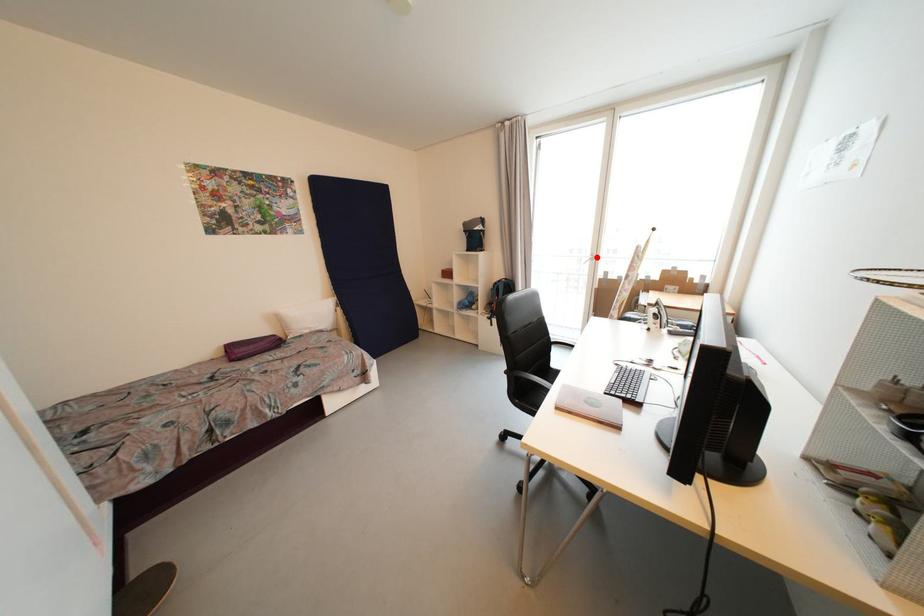
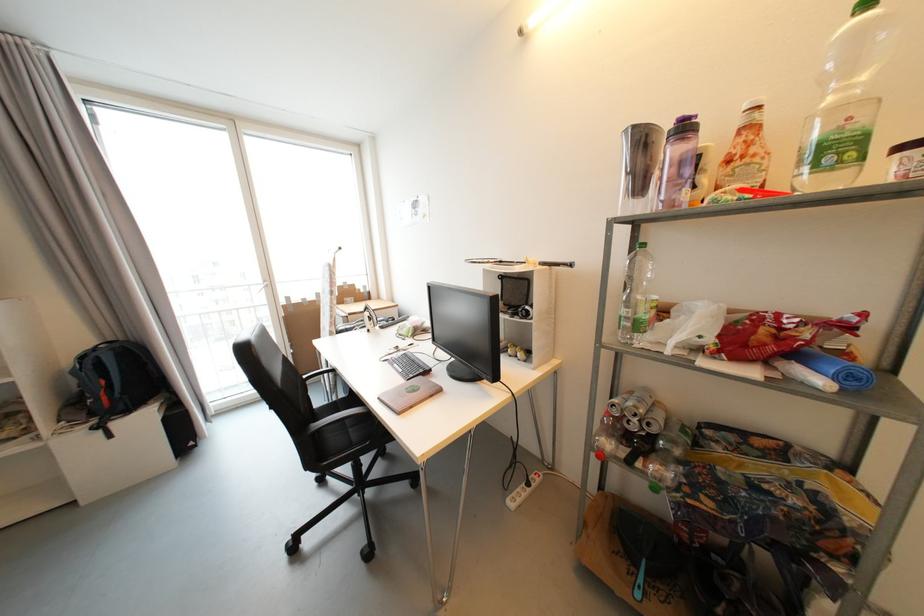
Find the pixel in the second image that matches the highlighted location in the first image.

(271, 283)